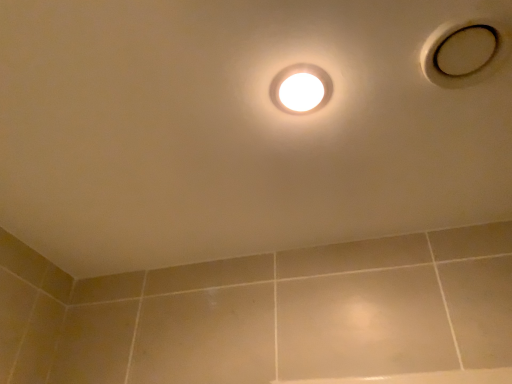
Question: Considering the relative positions of white glossy droplight at center and white matte hole at upper right in the image provided, is white glossy droplight at center to the right of white matte hole at upper right from the viewer's perspective?

Choices:
 (A) no
 (B) yes

Answer: (A)

Question: Is white glossy droplight at center positioned beyond the bounds of white matte hole at upper right?

Choices:
 (A) no
 (B) yes

Answer: (B)

Question: From the image's perspective, does white glossy droplight at center appear higher than white matte hole at upper right?

Choices:
 (A) yes
 (B) no

Answer: (B)

Question: Is the depth of white glossy droplight at center greater than that of white matte hole at upper right?

Choices:
 (A) yes
 (B) no

Answer: (A)

Question: Does white glossy droplight at center have a greater width compared to white matte hole at upper right?

Choices:
 (A) yes
 (B) no

Answer: (B)

Question: Is white glossy droplight at center shorter than white matte hole at upper right?

Choices:
 (A) yes
 (B) no

Answer: (A)

Question: Can you confirm if white matte hole at upper right is shorter than white glossy droplight at center?

Choices:
 (A) no
 (B) yes

Answer: (A)

Question: Is white matte hole at upper right smaller than white glossy droplight at center?

Choices:
 (A) no
 (B) yes

Answer: (A)

Question: Would you say white matte hole at upper right contains white glossy droplight at center?

Choices:
 (A) no
 (B) yes

Answer: (A)

Question: From a real-world perspective, is white matte hole at upper right under white glossy droplight at center?

Choices:
 (A) yes
 (B) no

Answer: (B)

Question: Is white matte hole at upper right further to the viewer compared to white glossy droplight at center?

Choices:
 (A) no
 (B) yes

Answer: (A)

Question: Are white matte hole at upper right and white glossy droplight at center far apart?

Choices:
 (A) yes
 (B) no

Answer: (B)

Question: Looking at their shapes, would you say white matte hole at upper right is wider or thinner than white glossy droplight at center?

Choices:
 (A) wide
 (B) thin

Answer: (A)